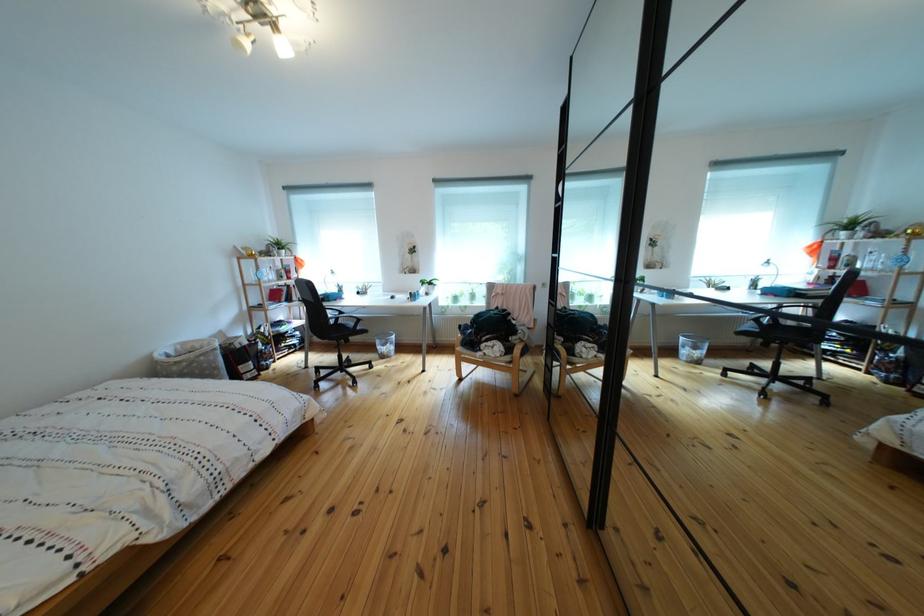
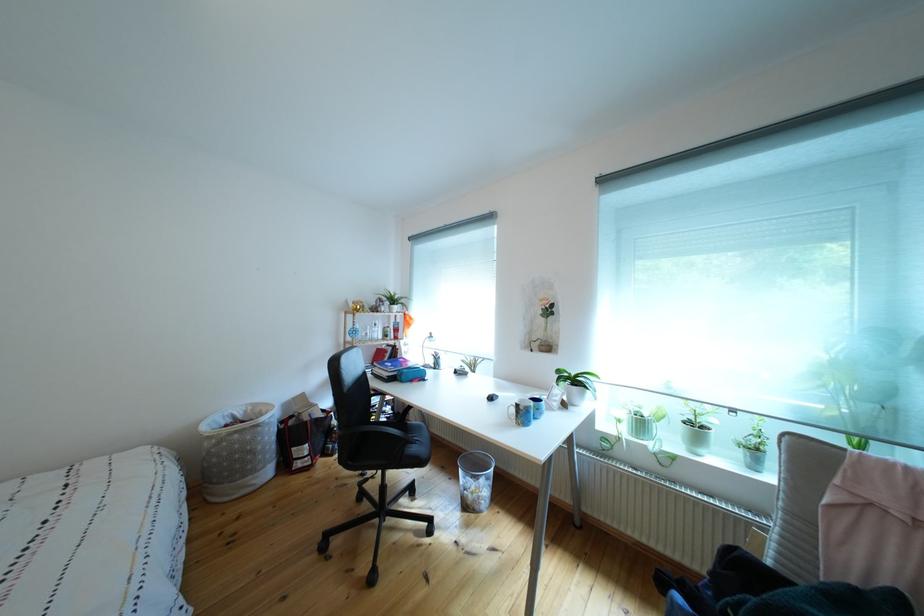
In the second image, find the point that corresponds to point (424, 302) in the first image.

(533, 419)